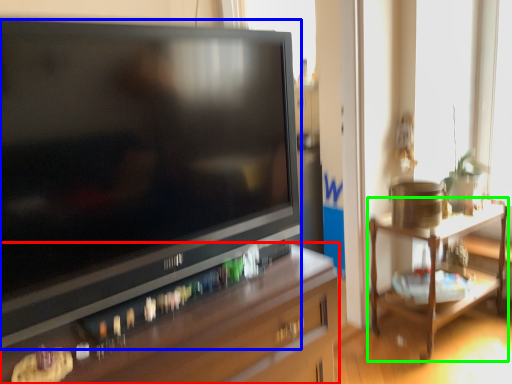
Question: Considering the real-world distances, which object is closest to desk (highlighted by a red box)? television (highlighted by a blue box) or table (highlighted by a green box).

Choices:
 (A) television
 (B) table

Answer: (A)